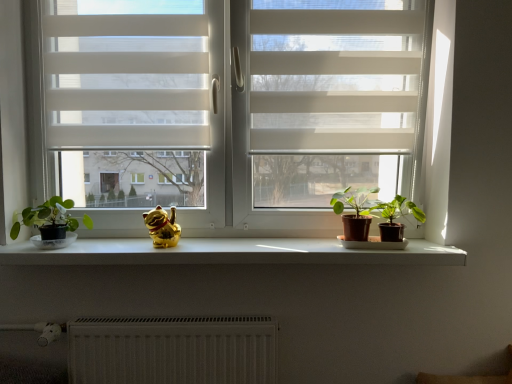
You are a GUI agent. You are given a task and a screenshot of the screen. Output one action in this format:
    pyautogui.click(x=<x>, y=<y>)
    Task: Click on the blank space to the left of gold shiny cat at center
    This screenshot has width=512, height=384.
    Given the screenshot: What is the action you would take?
    coord(115,246)